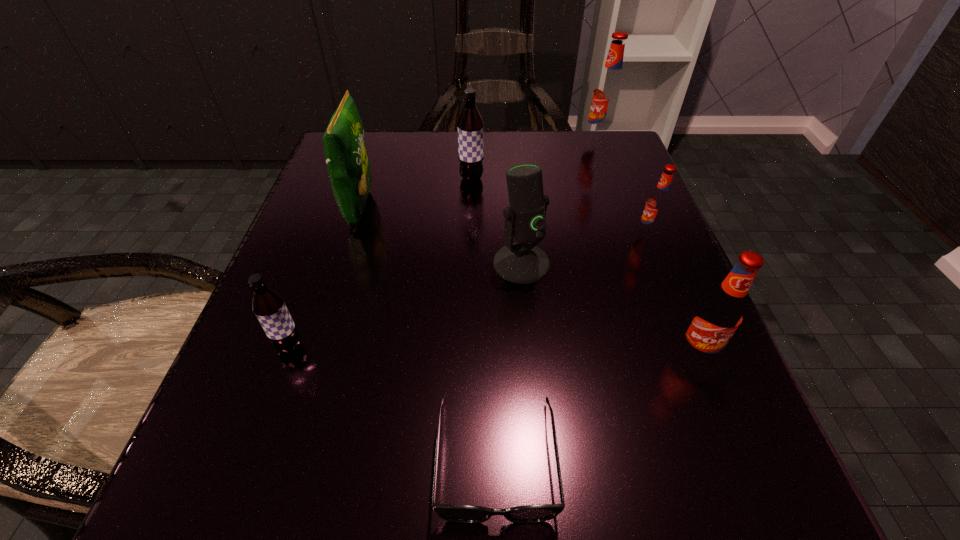
You are a GUI agent. You are given a task and a screenshot of the screen. Output one action in this format:
    pyautogui.click(x=<x>, y=<y>)
    Task: Click on the nearer brown root beer
    This screenshot has height=540, width=960.
    Given the screenshot: What is the action you would take?
    pyautogui.click(x=269, y=307)

Locate an element on the screen. The width and height of the screenshot is (960, 540). sunglasses is located at coordinates (450, 512).

Image resolution: width=960 pixels, height=540 pixels. What are the coordinates of `the nearest object` in the screenshot? It's located at (450, 512).

This screenshot has width=960, height=540. I want to click on vacant space located on the left of the farthest red root beer, so click(x=439, y=140).

In order to click on blank area located 0.310m on the front-facing side of the green crisp (potato chip) in this screenshot , I will do pyautogui.click(x=540, y=208).

The width and height of the screenshot is (960, 540). Find the location of `vacant point located on the right of the bigger brown root beer`. vacant point located on the right of the bigger brown root beer is located at coordinates (617, 179).

Identify the location of free space located on the left of the second biggest red root beer. (435, 354).

The width and height of the screenshot is (960, 540). I want to click on free space located 0.200m on the back of the fourth nearest object, so click(x=514, y=179).

The width and height of the screenshot is (960, 540). Identify the location of vacant area located on the front of the third farthest root beer. (676, 302).

At what (x,y) coordinates should I click in order to perform the action: click on vacant position located 0.330m on the back of the smaller brown root beer. Please return your answer as a coordinate pair (x, y). Looking at the image, I should click on (344, 196).